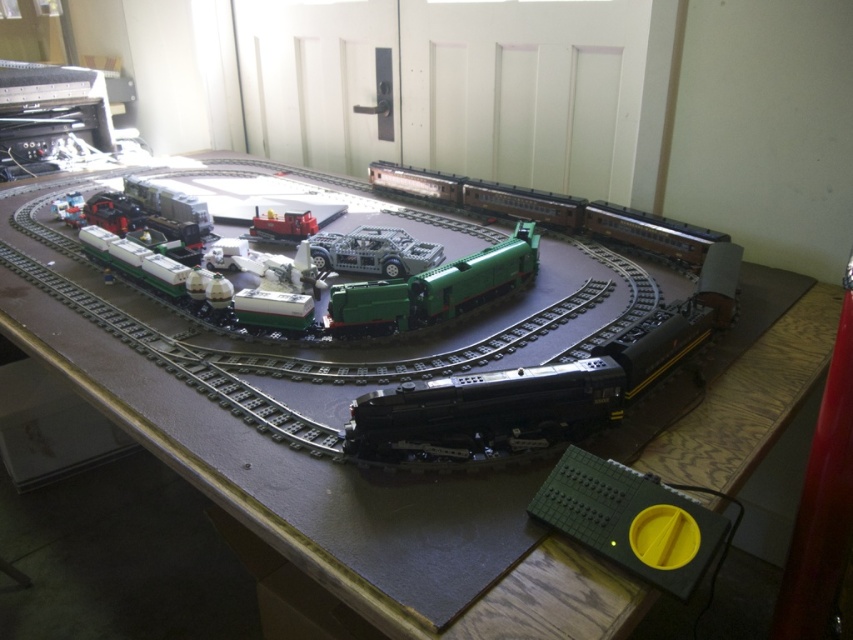
Does shiny black train at center have a greater width compared to green plastic train at center?

Incorrect, shiny black train at center's width does not surpass green plastic train at center's.

Does shiny black train at center appear over green plastic train at center?

No, shiny black train at center is not above green plastic train at center.

Find the location of `shiny black train at center`. shiny black train at center is located at coordinates (523, 397).

Image resolution: width=853 pixels, height=640 pixels. I want to click on shiny black train at center, so click(523, 397).

Who is higher up, shiny black train at center or translucent gray plastic car at center?

translucent gray plastic car at center is higher up.

Does shiny black train at center appear on the right side of translucent gray plastic car at center?

Correct, you'll find shiny black train at center to the right of translucent gray plastic car at center.

At what (x,y) coordinates should I click in order to perform the action: click on shiny black train at center. Please return your answer as a coordinate pair (x, y). Looking at the image, I should click on (523, 397).

How much distance is there between shiny black train at center and brown matte train car at center?

They are 25.42 inches apart.

Which of these two, shiny black train at center or brown matte train car at center, stands shorter?

With less height is shiny black train at center.

This screenshot has width=853, height=640. Describe the element at coordinates (523, 397) in the screenshot. I see `shiny black train at center` at that location.

The width and height of the screenshot is (853, 640). I want to click on shiny black train at center, so click(523, 397).